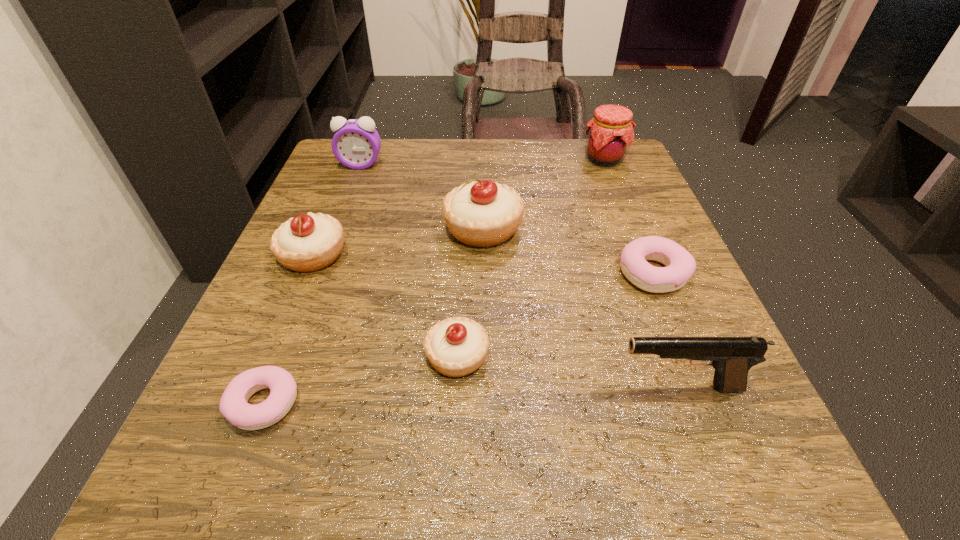
In order to click on free space between the sixth tallest object and the alarm clock in this screenshot , I will do `click(409, 260)`.

Locate an element on the screen. free space between the smaller pink pastry and the biggest beige pastry is located at coordinates (373, 316).

The image size is (960, 540). Identify the location of unoccupied position between the leftmost beige pastry and the black pistol. click(x=496, y=321).

Identify the location of vacant space in between the jam and the seventh tallest object. (629, 216).

Image resolution: width=960 pixels, height=540 pixels. Find the location of `vacant area that lies between the alarm clock and the jam`. vacant area that lies between the alarm clock and the jam is located at coordinates (483, 162).

This screenshot has width=960, height=540. Identify the location of vacant region between the sixth tallest object and the fifth tallest object. (385, 306).

Find the location of a particular element. unoccupied position between the biggest beige pastry and the second biggest beige pastry is located at coordinates (398, 241).

What are the coordinates of `vacant region between the black pistol and the nearer pink pastry` in the screenshot? It's located at (471, 396).

Locate an element on the screen. This screenshot has height=540, width=960. object that stands as the second closest to the jam is located at coordinates (680, 265).

Identify the location of the third closest object to the third shortest object. This screenshot has width=960, height=540. (481, 214).